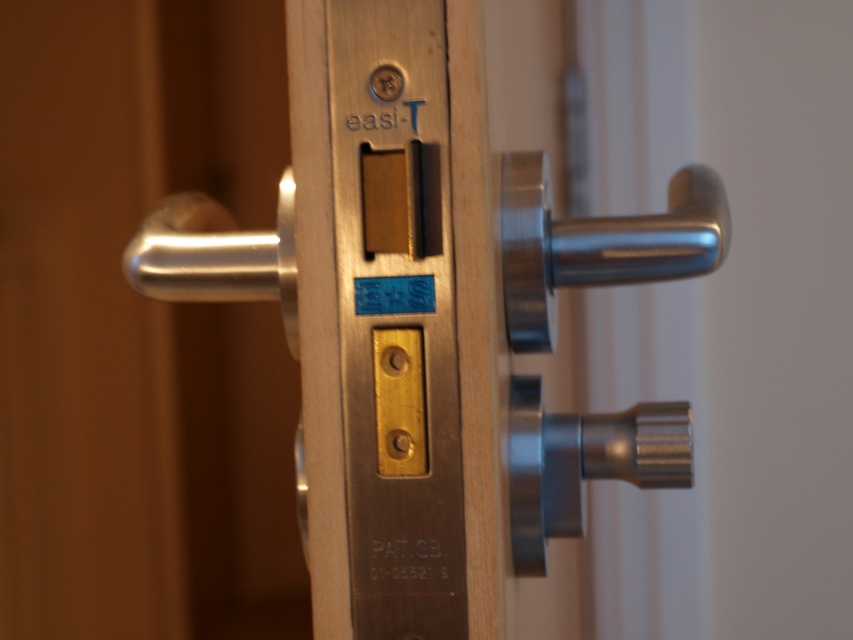
Question: Where is satin nickel handle at center right located in relation to satin silver handle at left in the image?

Choices:
 (A) below
 (B) above

Answer: (B)

Question: Estimate the real-world distances between objects in this image. Which object is farther from the satin metal knob at lower right?

Choices:
 (A) satin nickel handle at center right
 (B) satin silver handle at left

Answer: (B)

Question: Considering the real-world distances, which object is closest to the satin silver handle at left?

Choices:
 (A) satin metal knob at lower right
 (B) satin nickel handle at center right

Answer: (B)

Question: Which of the following is the farthest from the observer?

Choices:
 (A) satin silver handle at left
 (B) satin metal knob at lower right
 (C) satin nickel handle at center right

Answer: (B)

Question: Does satin nickel handle at center right have a smaller size compared to satin metal knob at lower right?

Choices:
 (A) yes
 (B) no

Answer: (B)

Question: Can you confirm if satin metal knob at lower right is thinner than satin silver handle at left?

Choices:
 (A) no
 (B) yes

Answer: (B)